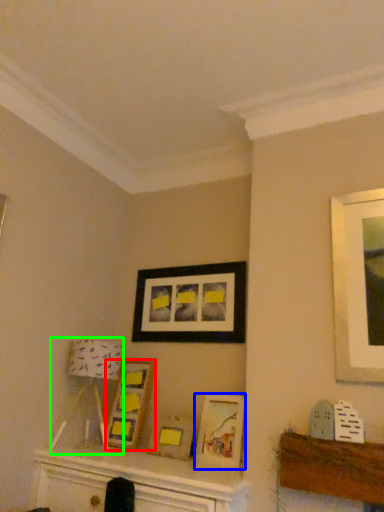
Question: Based on their relative distances, which object is farther from picture frame (highlighted by a red box)? Choose from picture frame (highlighted by a blue box) and lamp (highlighted by a green box).

Choices:
 (A) picture frame
 (B) lamp

Answer: (A)